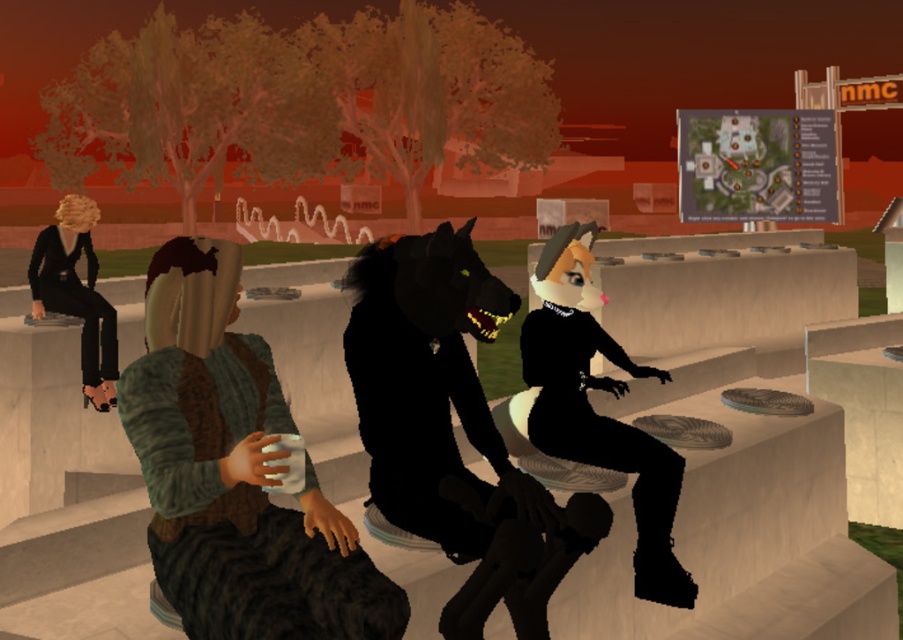
Question: Considering the relative positions of knitted sweater at center and black matte pants at left in the image provided, where is knitted sweater at center located with respect to black matte pants at left?

Choices:
 (A) below
 (B) above

Answer: (A)

Question: Which point is farther to the camera?

Choices:
 (A) tap(173, 520)
 (B) tap(98, 348)
 (C) tap(411, 275)
 (D) tap(533, 570)

Answer: (B)

Question: Among these objects, which one is farthest from the camera?

Choices:
 (A) knitted sweater at center
 (B) black matte wolf at center

Answer: (B)

Question: Which is nearer to the black matte pants at left?

Choices:
 (A) shiny black fur at center
 (B) black matte wolf at center

Answer: (B)

Question: Is black matte wolf at center to the left of shiny black fur at center from the viewer's perspective?

Choices:
 (A) yes
 (B) no

Answer: (A)

Question: Does knitted sweater at center appear over black matte cat at center?

Choices:
 (A) no
 (B) yes

Answer: (A)